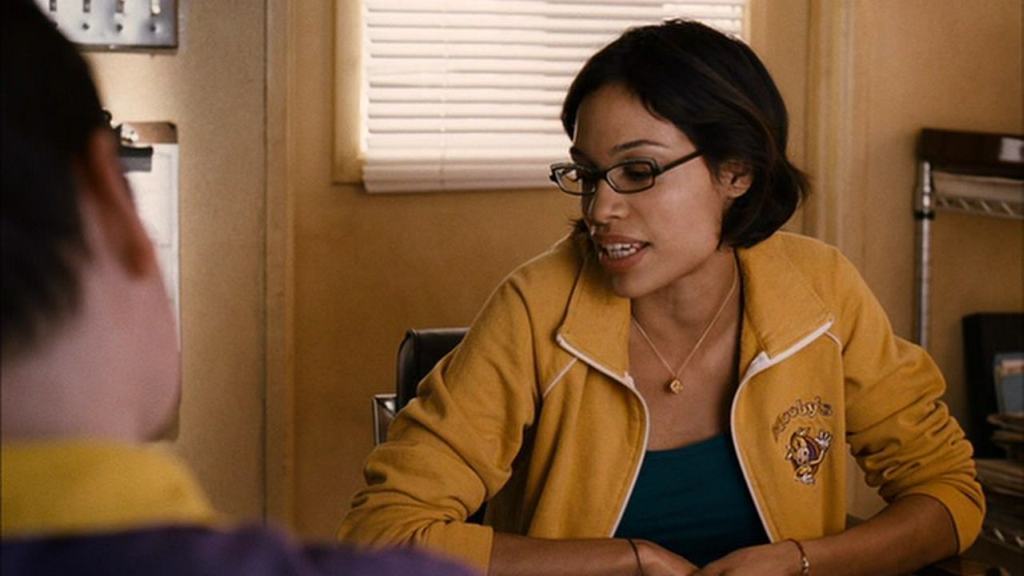
At what (x,y) coordinates should I click in order to perform the action: click on trim. Please return your answer as a coordinate pair (x, y). The image size is (1024, 576). Looking at the image, I should click on (285, 305), (812, 125).